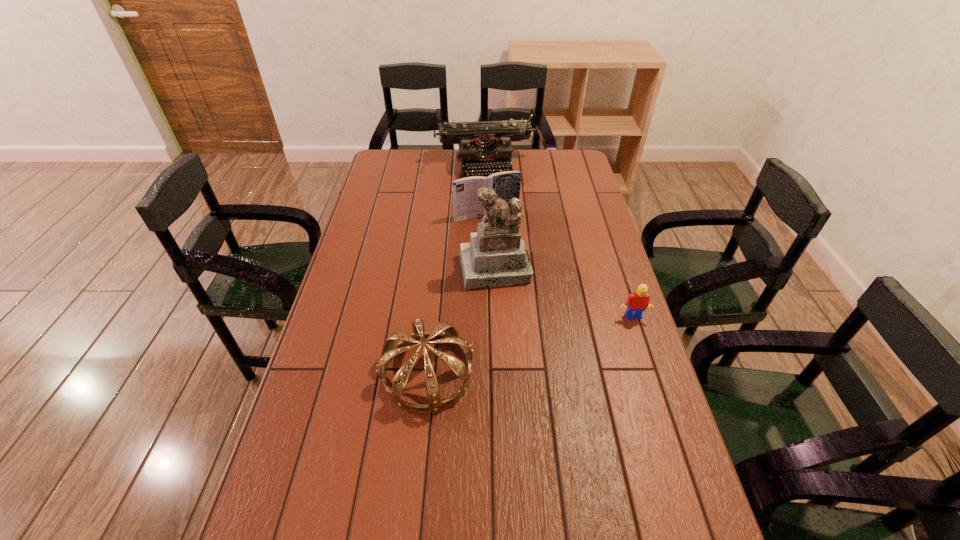
Locate an element on the screen. free space between the shortest object and the typewriter is located at coordinates (559, 242).

Locate an element on the screen. empty location between the typewriter and the tiara is located at coordinates (457, 270).

Identify which object is located as the third nearest to the book. Please provide its 2D coordinates. Your answer should be formatted as a tuple, i.e. [(x, y)], where the tuple contains the x and y coordinates of a point satisfying the conditions above.

[(636, 303)]

Locate an element on the screen. The width and height of the screenshot is (960, 540). object that is the second nearest to the shortest object is located at coordinates (391, 348).